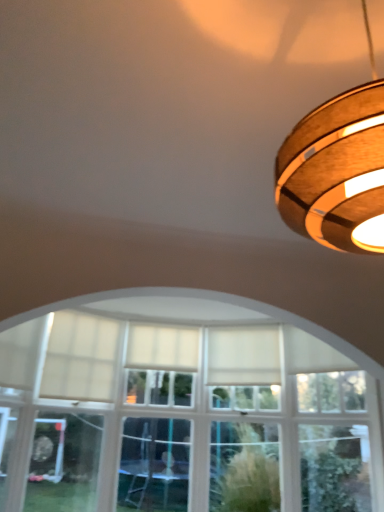
Question: Considering the relative positions of white sheer curtain at center, which is counted as the first curtain, starting from the left, and white fabric curtain at center, the 2th curtain when ordered from left to right, in the image provided, is white sheer curtain at center, which is counted as the first curtain, starting from the left, to the right of white fabric curtain at center, the 2th curtain when ordered from left to right, from the viewer's perspective?

Choices:
 (A) no
 (B) yes

Answer: (A)

Question: Considering the relative sizes of white sheer curtain at center, which is counted as the first curtain, starting from the left, and white fabric curtain at center, the 2th curtain when ordered from left to right, in the image provided, is white sheer curtain at center, which is counted as the first curtain, starting from the left, smaller than white fabric curtain at center, the 2th curtain when ordered from left to right,?

Choices:
 (A) no
 (B) yes

Answer: (B)

Question: Does white sheer curtain at center, the second curtain positioned from the right, touch white fabric curtain at center, which is counted as the first curtain, starting from the right?

Choices:
 (A) no
 (B) yes

Answer: (A)

Question: From the image's perspective, is white sheer curtain at center, which is counted as the first curtain, starting from the left, on top of white fabric curtain at center, which is counted as the first curtain, starting from the right?

Choices:
 (A) no
 (B) yes

Answer: (A)

Question: Is white sheer curtain at center, the second curtain positioned from the right, closer to the viewer compared to white fabric curtain at center, which is counted as the first curtain, starting from the right?

Choices:
 (A) yes
 (B) no

Answer: (A)

Question: From a real-world perspective, is white sheer curtain at center, the second curtain positioned from the right, on white fabric curtain at center, which is counted as the first curtain, starting from the right?

Choices:
 (A) no
 (B) yes

Answer: (A)

Question: Does white sheer curtain at center, which is counted as the first curtain, starting from the left, have a larger size compared to wooden ring light at upper right?

Choices:
 (A) yes
 (B) no

Answer: (B)

Question: Is white sheer curtain at center, the second curtain positioned from the right, aimed at wooden ring light at upper right?

Choices:
 (A) yes
 (B) no

Answer: (A)

Question: Considering the relative sizes of white sheer curtain at center, the second curtain positioned from the right, and wooden ring light at upper right in the image provided, is white sheer curtain at center, the second curtain positioned from the right, wider than wooden ring light at upper right?

Choices:
 (A) no
 (B) yes

Answer: (A)

Question: From a real-world perspective, is white sheer curtain at center, which is counted as the first curtain, starting from the left, physically below wooden ring light at upper right?

Choices:
 (A) yes
 (B) no

Answer: (A)

Question: Does white sheer curtain at center, which is counted as the first curtain, starting from the left, have a greater height compared to wooden ring light at upper right?

Choices:
 (A) yes
 (B) no

Answer: (B)

Question: Does wooden ring light at upper right touch white fabric curtain at center, which is counted as the first curtain, starting from the right?

Choices:
 (A) yes
 (B) no

Answer: (B)